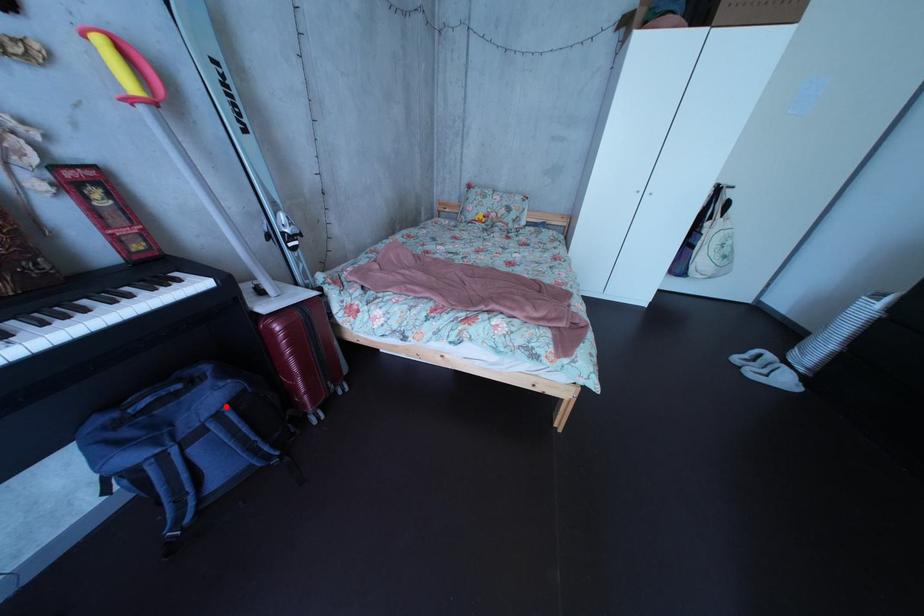
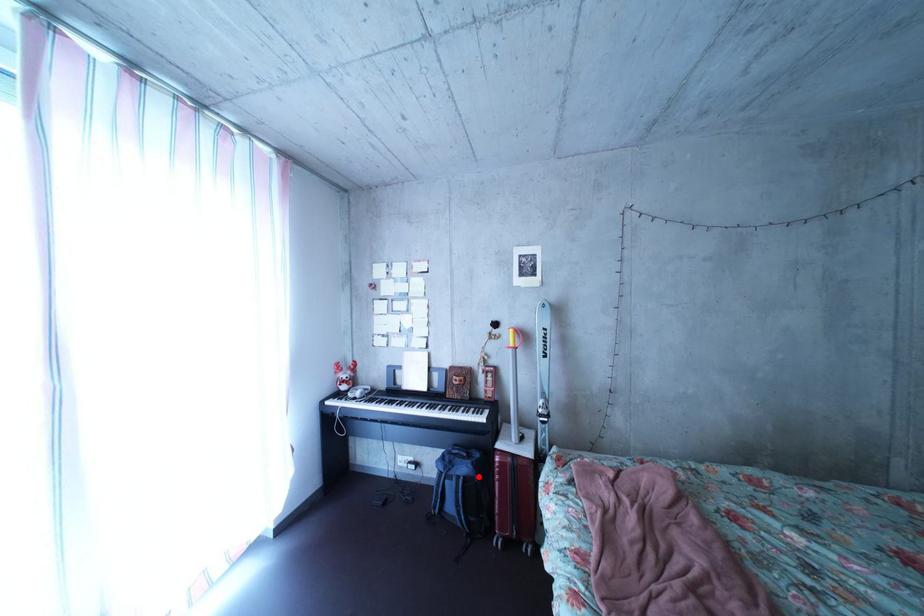
I am providing you with two images of the same scene from different viewpoints. A red point is marked on the first image and another point is marked on the second image. Is the red point in image1 aligned with the point shown in image2?

Yes